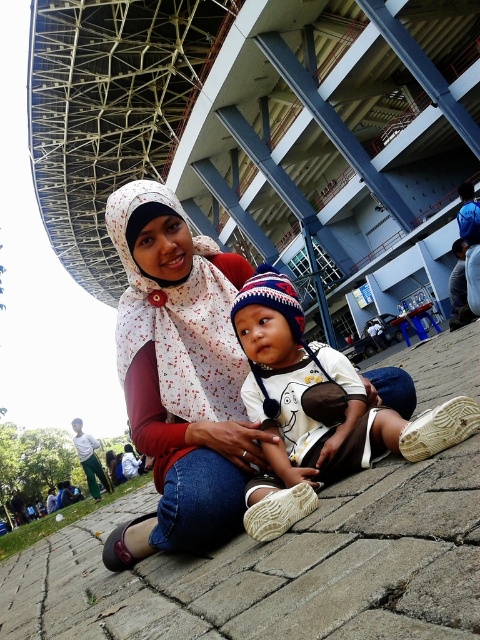
Describe the element at coordinates (275, 570) in the screenshot. I see `brick pavement at center` at that location.

Which is below, brick pavement at center or white matte baby at center?

brick pavement at center is below.

Who is more distant from viewer, (x=444, y=545) or (x=328, y=465)?

The point (x=328, y=465) is behind.

Find the location of a particular element. Image resolution: width=480 pixels, height=640 pixels. brick pavement at center is located at coordinates (275, 570).